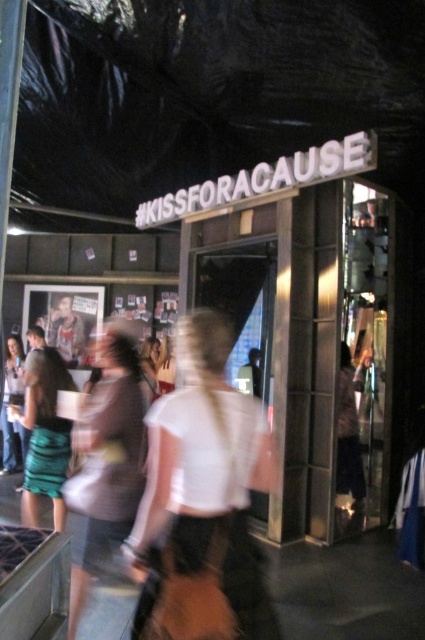
You are standing at the entrance of the event marked by the hashtag displayed above. You notice two people in white shirts at the center of the image. Which one is closer to you, the white matte shirt at center or the white cotton shirt at center?

The white matte shirt at center is closer to the viewer than the white cotton shirt at center.

You are organizing a photo shoot and need to ensure that the two main subjects, the white cotton shirt at center and the green satin dress at left, are positioned at least 1 meter apart for proper lighting. Based on the scene description, is their current distance sufficient?

The white cotton shirt at center is 60.31 centimeters from the green satin dress at left. Since 60.31 centimeters is less than 1 meter, the current distance is insufficient for the required separation of at least 1 meter.

You are organizing a photo shoot for a fashion magazine and need to choose between the white matte shirt at center and the green satin dress at left based on their sizes. According to the scene description, which clothing item is bigger?

The white matte shirt at center is larger in size than the green satin dress at left, so the white matte shirt at center is bigger.